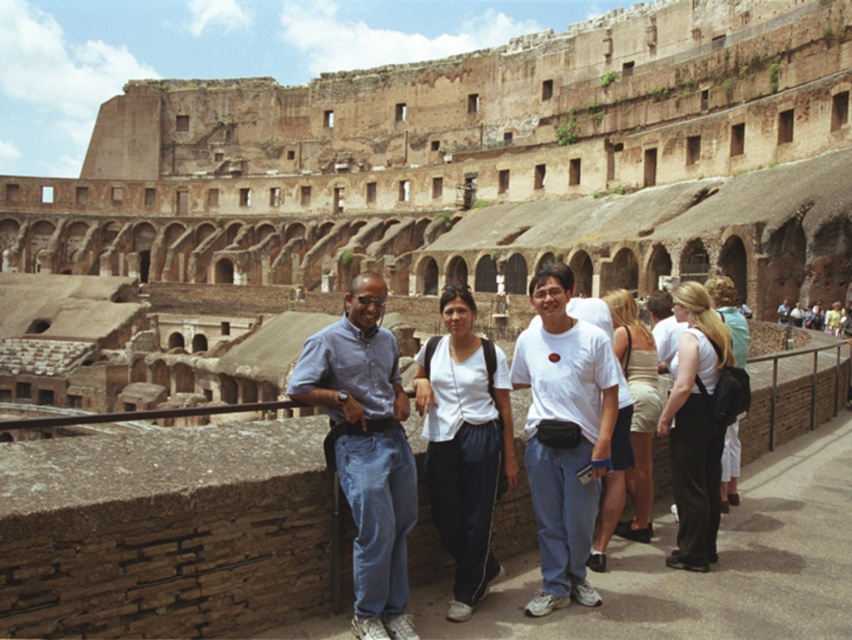
You are a photographer trying to capture a clear shot of the blue denim jeans at center and the beige fabric skirt at center. Since you can only focus on one subject at a time, which one should you focus on to ensure it appears sharp in the photo?

The blue denim jeans at center is in front of the beige fabric skirt at center, so focusing on the blue denim jeans at center will ensure it appears sharp while the background subject may be slightly blurred.